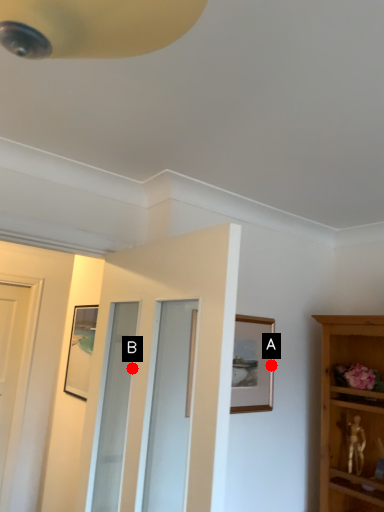
Question: Two points are circled on the image, labeled by A and B beside each circle. Among these points, which one is farthest from the camera?

Choices:
 (A) A is further
 (B) B is further

Answer: (A)